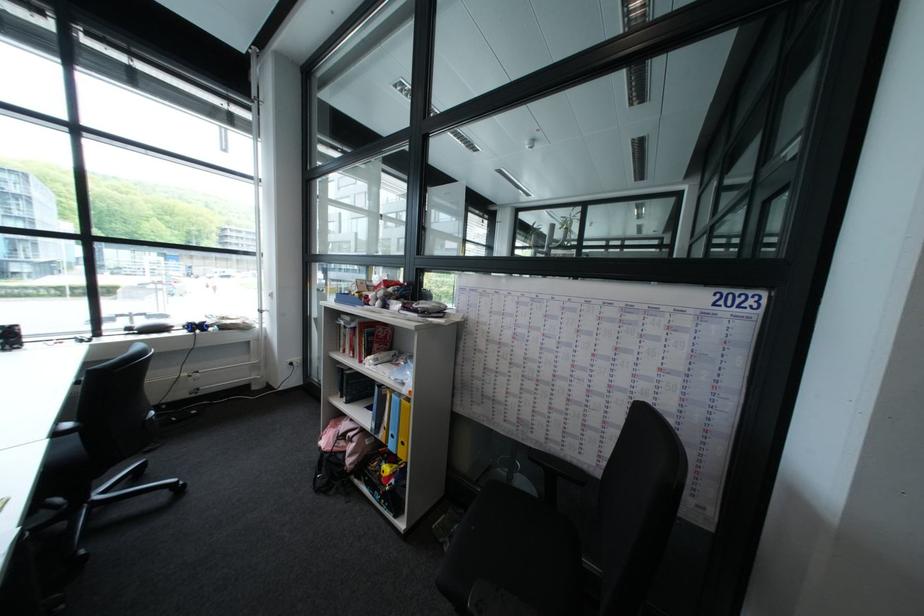
The height and width of the screenshot is (616, 924). What are the coordinates of `gaming controller` in the screenshot? It's located at (196, 326).